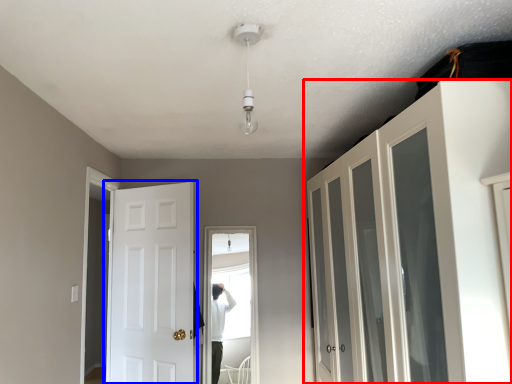
Question: Which object is closer to the camera taking this photo, cupboard (highlighted by a red box) or door (highlighted by a blue box)?

Choices:
 (A) cupboard
 (B) door

Answer: (A)